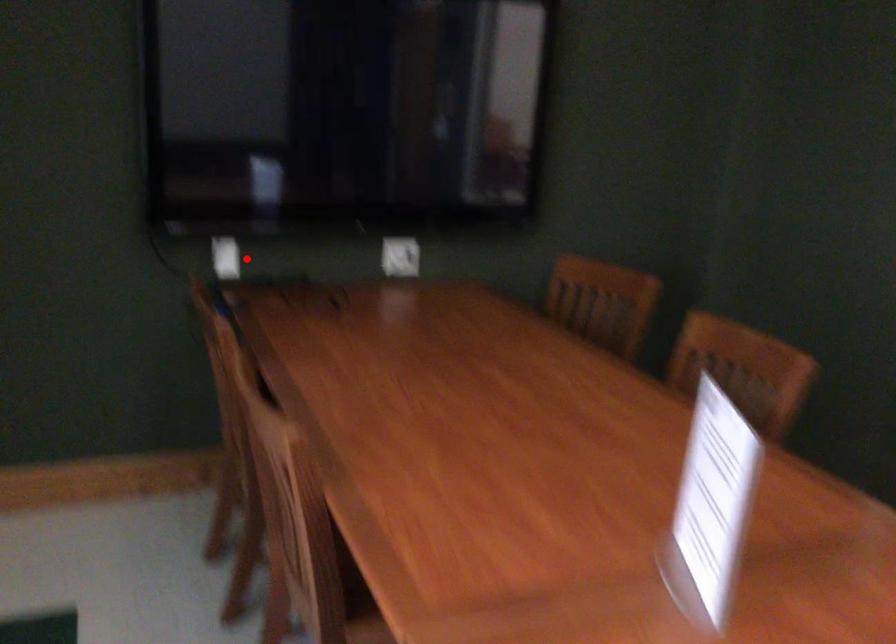
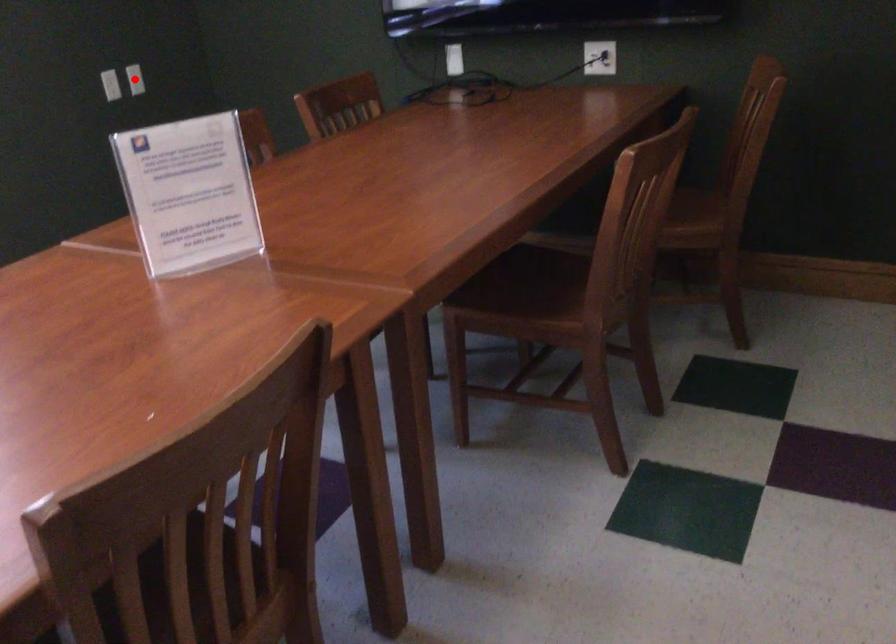
I am providing you with two images of the same scene from different viewpoints. A red point is marked on the first image and another point is marked on the second image. Is the marked point in image1 the same physical position as the marked point in image2?

No